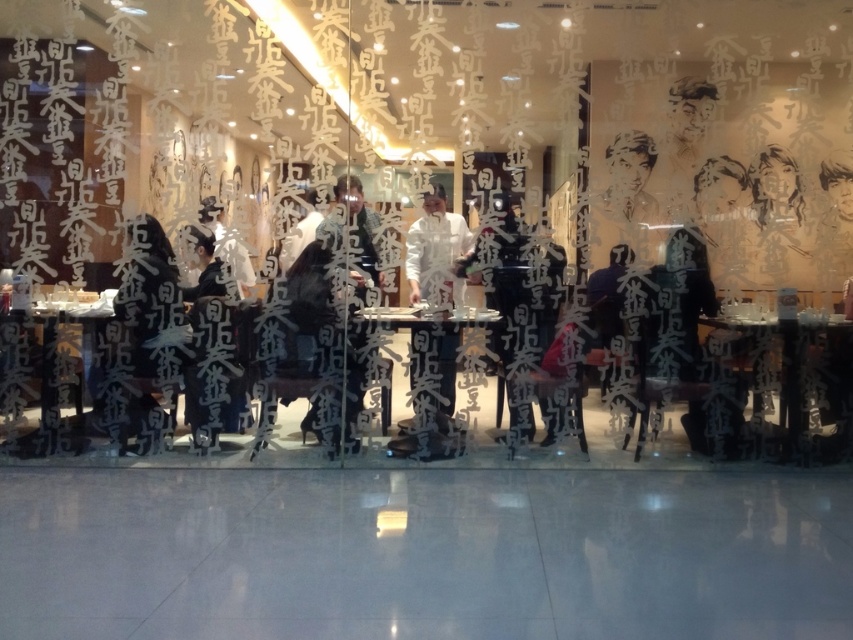
Question: Can you confirm if transparent glass table at lower right is smaller than white matte chef coat at center?

Choices:
 (A) yes
 (B) no

Answer: (B)

Question: Does metallic silver table at center appear on the left side of white matte chef coat at center?

Choices:
 (A) yes
 (B) no

Answer: (A)

Question: Considering the real-world distances, which object is closest to the white matte chef coat at center?

Choices:
 (A) black matte jacket at left
 (B) matte black shirt at center
 (C) metallic silver table at center

Answer: (C)

Question: Which object appears farthest from the camera in this image?

Choices:
 (A) transparent glass table at lower right
 (B) metallic silver table at center
 (C) black matte jacket at left

Answer: (B)

Question: Which of the following is the closest to the observer?

Choices:
 (A) (178, 296)
 (B) (438, 365)
 (C) (720, 316)

Answer: (A)

Question: In this image, where is black matte jacket at left located relative to matte black shirt at center?

Choices:
 (A) above
 (B) below

Answer: (B)